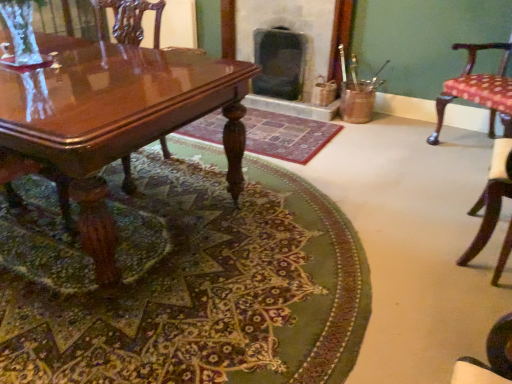
Where is `blank space situated above green woven rug at center, placed as the first mat when sorted from back to front (from a real-world perspective)`? This screenshot has width=512, height=384. blank space situated above green woven rug at center, placed as the first mat when sorted from back to front (from a real-world perspective) is located at coordinates (272, 127).